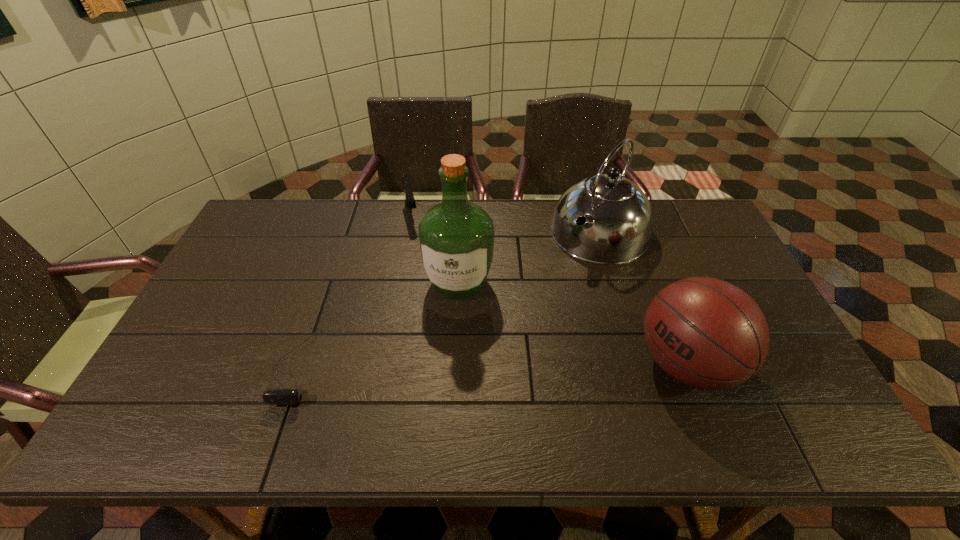
Find the location of a particular element. This screenshot has width=960, height=540. vacant space situated on the front-facing side of the tallest object is located at coordinates (445, 363).

Locate an element on the screen. The height and width of the screenshot is (540, 960). vacant area situated 0.050m on the front-facing side of the tallest object is located at coordinates (452, 323).

At what (x,y) coordinates should I click in order to perform the action: click on free region located from the spout of the second tallest object. Please return your answer as a coordinate pair (x, y). This screenshot has height=540, width=960. Looking at the image, I should click on (523, 316).

Locate an element on the screen. vacant space located from the spout of the second tallest object is located at coordinates (564, 271).

Locate an element on the screen. The height and width of the screenshot is (540, 960). vacant region located from the spout of the second tallest object is located at coordinates (537, 301).

Identify the location of free space located on the front-facing side of the second object from left to right. This screenshot has height=540, width=960. (432, 305).

Locate an element on the screen. free region located on the front-facing side of the second object from left to right is located at coordinates (420, 259).

At what (x,y) coordinates should I click in order to perform the action: click on vacant region located 0.290m on the front-facing side of the second object from left to right. Please return your answer as a coordinate pair (x, y). Looking at the image, I should click on (427, 288).

Find the location of `kettle that is positioned at the far edge`. kettle that is positioned at the far edge is located at coordinates (619, 221).

I want to click on pistol present at the far edge, so (x=409, y=197).